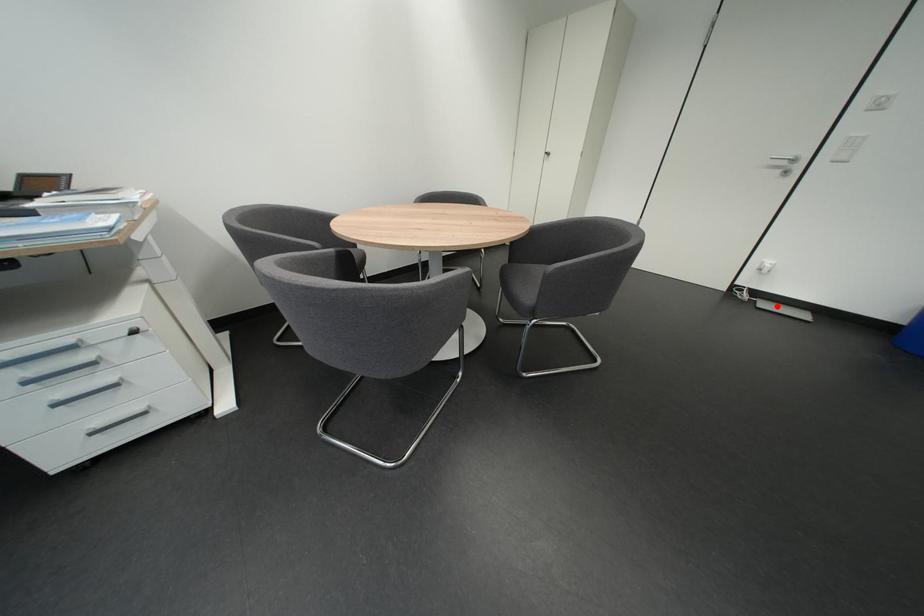
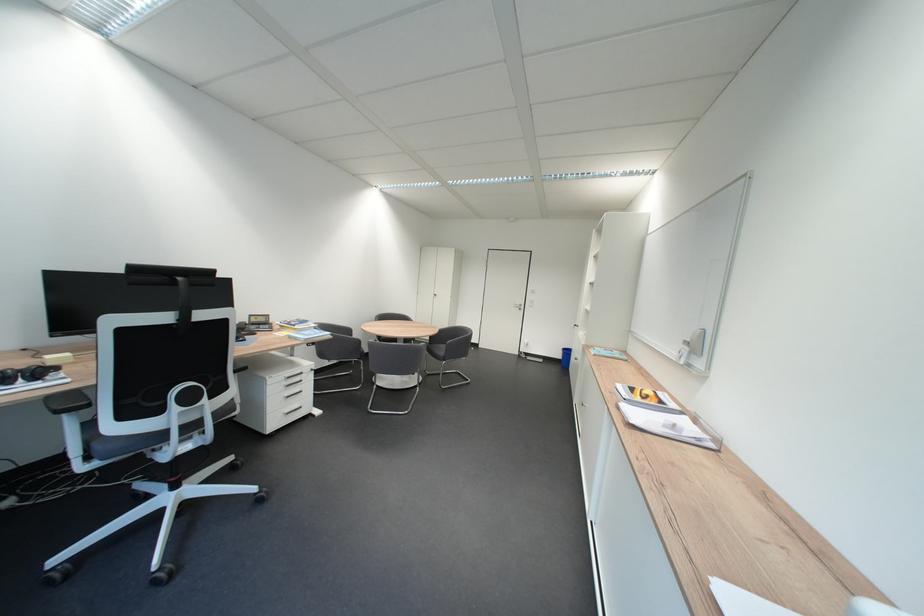
Question: A red point is marked in image1. In image2, is the corresponding 3D point closer to the camera or farther? Reply with the corresponding letter.

Choices:
 (A) The corresponding 3D point is closer.
 (B) The corresponding 3D point is farther.

Answer: (B)